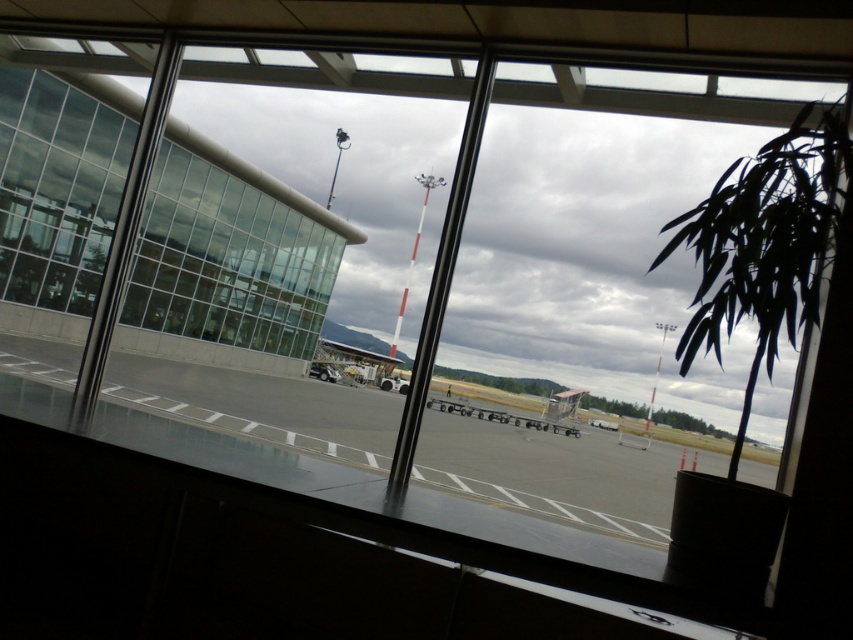
Question: Can you confirm if clear glass window at left is positioned to the left of metallic gray cart at center?

Choices:
 (A) yes
 (B) no

Answer: (A)

Question: Is metallic gray airplane at center further to the viewer compared to metallic gray cart at center?

Choices:
 (A) yes
 (B) no

Answer: (A)

Question: Which point is farther to the camera?

Choices:
 (A) (234, 355)
 (B) (335, 358)
 (C) (440, 403)

Answer: (B)

Question: Is clear glass window at left positioned behind metallic gray airplane at center?

Choices:
 (A) yes
 (B) no

Answer: (B)

Question: Which point appears farthest from the camera in this image?

Choices:
 (A) (566, 412)
 (B) (368, 381)
 (C) (248, 305)

Answer: (B)

Question: Which of the following is the farthest from the observer?

Choices:
 (A) metallic gray cart at center
 (B) clear glass window at left

Answer: (A)